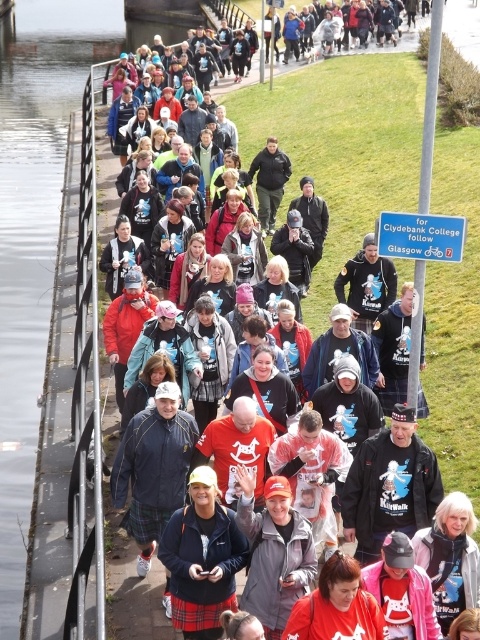
Question: Which object appears farthest from the camera in this image?

Choices:
 (A) smooth concrete waterway at left
 (B) plaid skirt at center

Answer: (A)

Question: Which of the following is the closest to the observer?

Choices:
 (A) (194, 518)
 (B) (47, 6)

Answer: (A)

Question: Is smooth concrete waterway at left to the right of plaid skirt at center from the viewer's perspective?

Choices:
 (A) no
 (B) yes

Answer: (A)

Question: Is smooth concrete waterway at left bigger than plaid skirt at center?

Choices:
 (A) yes
 (B) no

Answer: (A)

Question: Is smooth concrete waterway at left smaller than plaid skirt at center?

Choices:
 (A) yes
 (B) no

Answer: (B)

Question: Which object is closer to the camera taking this photo?

Choices:
 (A) plaid skirt at center
 (B) smooth concrete waterway at left

Answer: (A)